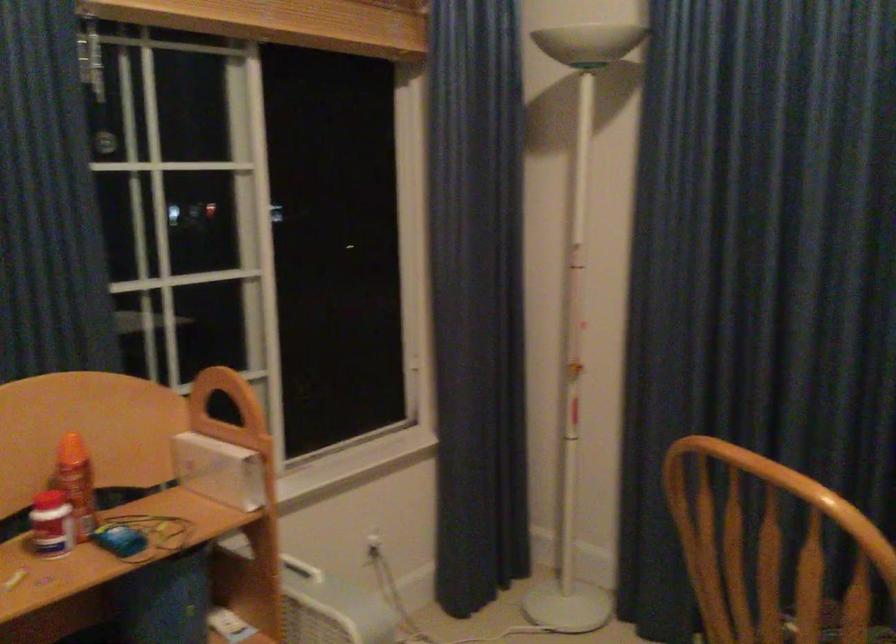
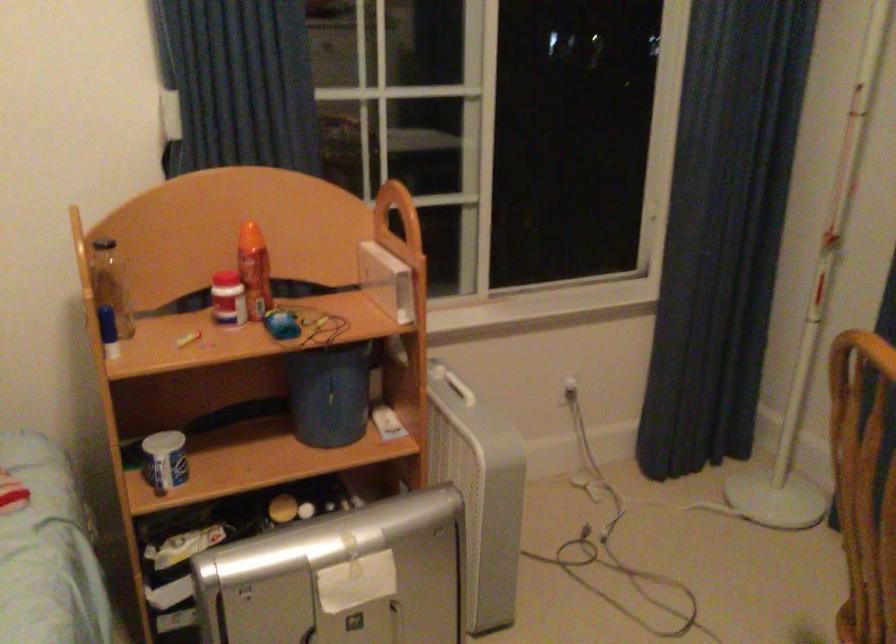
Where in the second image is the point corresponding to pixel 730 563 from the first image?

(864, 484)